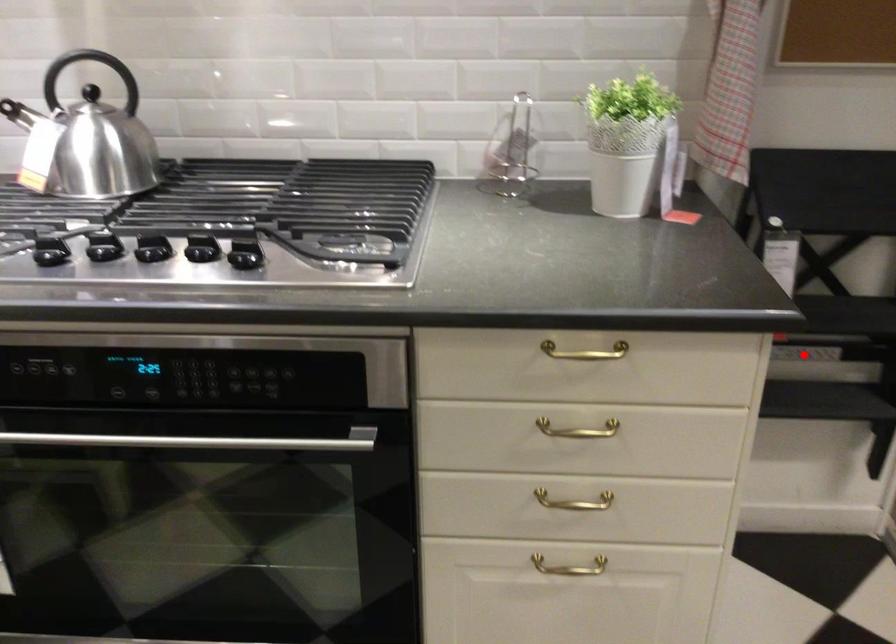
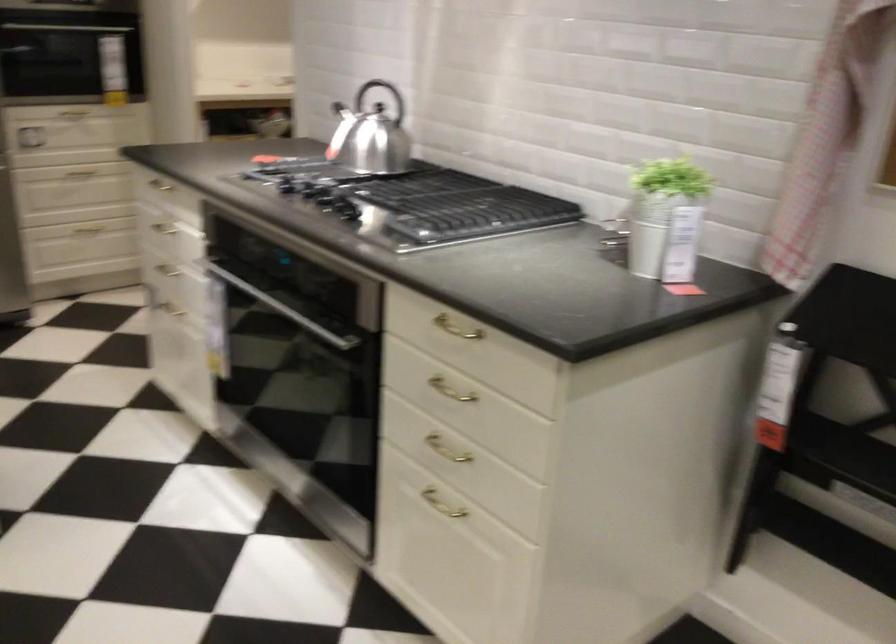
The point at the highlighted location is marked in the first image. Where is the corresponding point in the second image?

(859, 500)